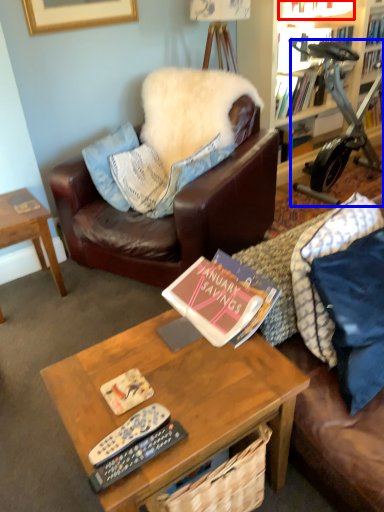
Question: Which object is closer to the camera taking this photo, book (highlighted by a red box) or stationary bicycle (highlighted by a blue box)?

Choices:
 (A) book
 (B) stationary bicycle

Answer: (B)